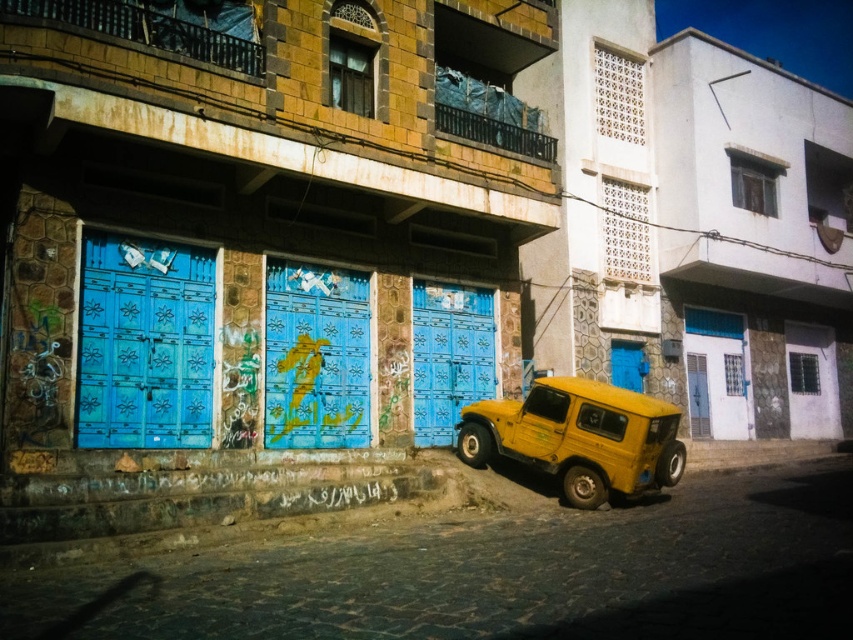
Which is more to the right, blue carved wood door at left or blue painted wooden door at center?

From the viewer's perspective, blue painted wooden door at center appears more on the right side.

Where is `blue carved wood door at left`? The height and width of the screenshot is (640, 853). blue carved wood door at left is located at coordinates coord(144,342).

You are a GUI agent. You are given a task and a screenshot of the screen. Output one action in this format:
    pyautogui.click(x=<x>, y=<y>)
    Task: Click on the blue carved wood door at left
    The height and width of the screenshot is (640, 853).
    Given the screenshot: What is the action you would take?
    pyautogui.click(x=144, y=342)

Between blue carved wood door at left and yellow matte pickup truck at center, which one appears on the left side from the viewer's perspective?

Positioned to the left is blue carved wood door at left.

Can you confirm if blue carved wood door at left is taller than yellow matte pickup truck at center?

Correct, blue carved wood door at left is much taller as yellow matte pickup truck at center.

Is point (143, 339) behind point (578, 492)?

No, (143, 339) is closer to viewer.

In order to click on blue carved wood door at left in this screenshot , I will do `click(144, 342)`.

Is the position of yellow matte pickup truck at center less distant than that of blue painted wood door at center?

Yes, it is.

You are a GUI agent. You are given a task and a screenshot of the screen. Output one action in this format:
    pyautogui.click(x=<x>, y=<y>)
    Task: Click on the yellow matte pickup truck at center
    
    Given the screenshot: What is the action you would take?
    pyautogui.click(x=579, y=436)